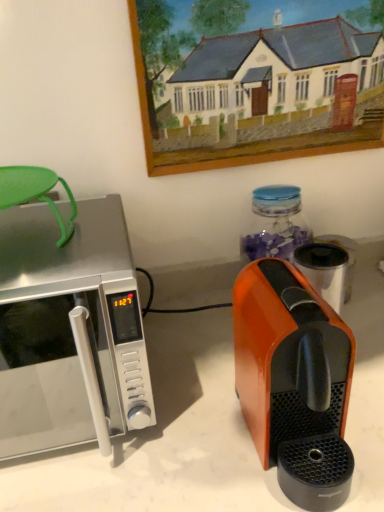
Question: Does orange glossy coffee maker at right appear on the right side of satin silver microwave at left?

Choices:
 (A) yes
 (B) no

Answer: (A)

Question: From a real-world perspective, does orange glossy coffee maker at right sit lower than satin silver microwave at left?

Choices:
 (A) yes
 (B) no

Answer: (A)

Question: Does orange glossy coffee maker at right have a greater width compared to satin silver microwave at left?

Choices:
 (A) yes
 (B) no

Answer: (B)

Question: Can you confirm if orange glossy coffee maker at right is taller than satin silver microwave at left?

Choices:
 (A) no
 (B) yes

Answer: (A)

Question: From a real-world perspective, is orange glossy coffee maker at right physically above satin silver microwave at left?

Choices:
 (A) no
 (B) yes

Answer: (A)

Question: From a real-world perspective, is wooden picture frame at upper center physically located above or below satin silver microwave at left?

Choices:
 (A) above
 (B) below

Answer: (A)

Question: Relative to satin silver microwave at left, is wooden picture frame at upper center in front or behind?

Choices:
 (A) behind
 (B) front

Answer: (A)

Question: From the image's perspective, is wooden picture frame at upper center above or below satin silver microwave at left?

Choices:
 (A) above
 (B) below

Answer: (A)

Question: From their relative heights in the image, would you say wooden picture frame at upper center is taller or shorter than satin silver microwave at left?

Choices:
 (A) short
 (B) tall

Answer: (B)

Question: Relative to orange glossy coffee maker at right, is satin silver microwave at left in front or behind?

Choices:
 (A) behind
 (B) front

Answer: (A)

Question: Is satin silver microwave at left taller or shorter than orange glossy coffee maker at right?

Choices:
 (A) short
 (B) tall

Answer: (B)

Question: Is point (36, 349) positioned closer to the camera than point (340, 429)?

Choices:
 (A) farther
 (B) closer

Answer: (A)

Question: Considering the positions of satin silver microwave at left and orange glossy coffee maker at right in the image, is satin silver microwave at left wider or thinner than orange glossy coffee maker at right?

Choices:
 (A) wide
 (B) thin

Answer: (A)

Question: Is orange glossy coffee maker at right bigger or smaller than satin silver microwave at left?

Choices:
 (A) small
 (B) big

Answer: (A)

Question: From a real-world perspective, relative to satin silver microwave at left, is orange glossy coffee maker at right vertically above or below?

Choices:
 (A) above
 (B) below

Answer: (B)